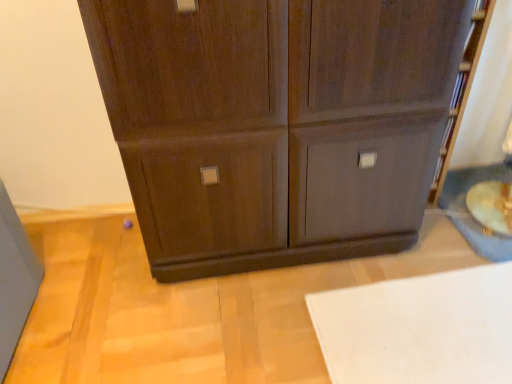
What do you see at coordinates (276, 124) in the screenshot? The image size is (512, 384). I see `dark wood cupboard at center` at bounding box center [276, 124].

Locate an element on the screen. The image size is (512, 384). dark wood cupboard at center is located at coordinates (276, 124).

Measure the distance between dark wood cupboard at center and camera.

dark wood cupboard at center and camera are 34.78 inches apart from each other.

Find the location of a particular element. dark wood cupboard at center is located at coordinates (276, 124).